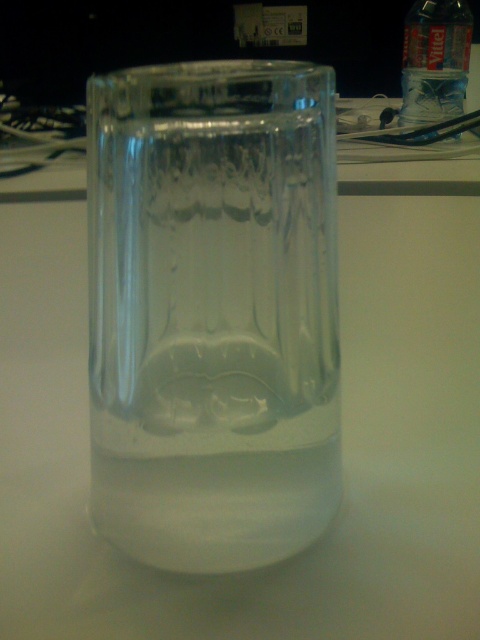
How far apart are transparent glass vase at center and transparent plastic bottle at upper right?

transparent glass vase at center and transparent plastic bottle at upper right are 30.24 inches apart.

Can you confirm if transparent glass vase at center is smaller than transparent plastic bottle at upper right?

Yes, transparent glass vase at center is smaller than transparent plastic bottle at upper right.

Who is more forward, (129, 163) or (418, 52)?

Point (129, 163)

Where is `transparent glass vase at center`? The height and width of the screenshot is (640, 480). transparent glass vase at center is located at coordinates (213, 310).